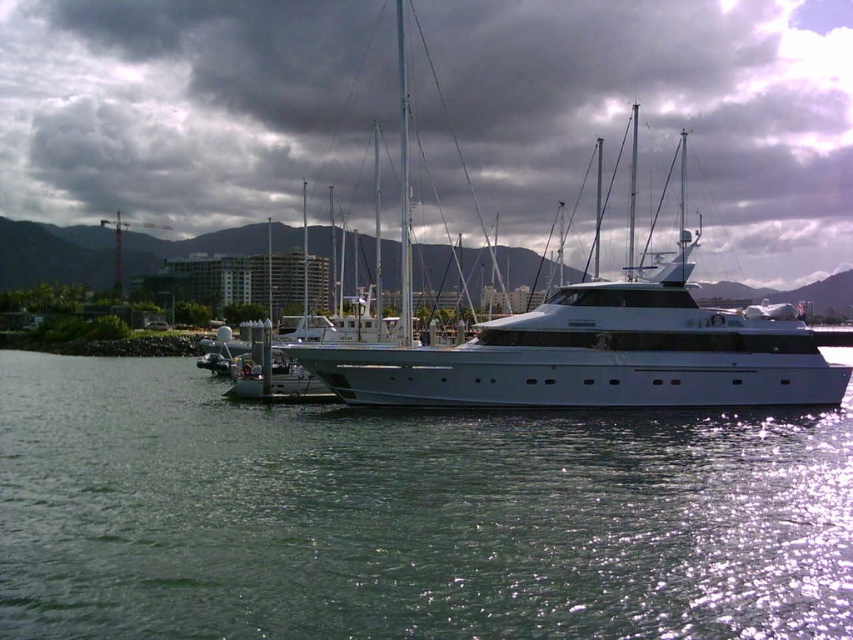
You are an artist planning to paint the marina scene. You need to decide which object to make larger in your painting to emphasize the tranquility of the water. Based on the scene, which object should you enlarge? Remember, you can only choose between the green water at lower center and the dark gray cloud at upper center.

To emphasize the tranquility of the water, you should enlarge the green water at lower center. Since the green water at lower center is currently smaller than the dark gray cloud at upper center, increasing its size in the painting will draw more attention to the calm water, enhancing the serene atmosphere of the marina scene.

You are standing at the edge of the marina and want to take a photo that includes both the green water at lower center and the white glossy yacht at center. Which object should you frame first in your camera to ensure both are in the shot?

You should frame the green water at lower center first since it is closer to the viewer than the white glossy yacht at center, ensuring both will be in the shot when positioned properly.

You are a photographer planning to capture the white glossy yacht at center and the green water at lower center in a single frame. Based on their positions, which object will appear larger in the photo?

The white glossy yacht at center will appear larger in the photo because it is taller than the green water at lower center, which is shorter in height.